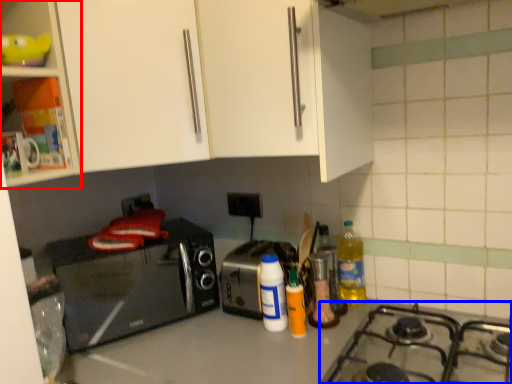
Question: Which object is closer to the camera taking this photo, cabinetry (highlighted by a red box) or gas stove (highlighted by a blue box)?

Choices:
 (A) cabinetry
 (B) gas stove

Answer: (B)